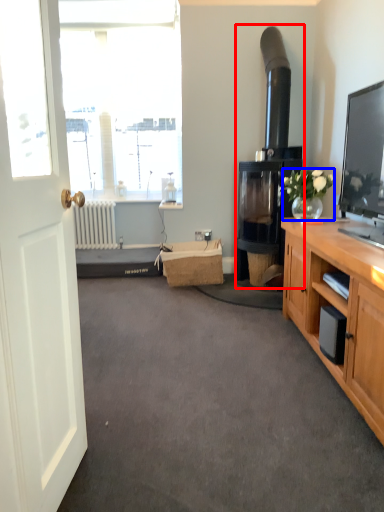
Question: Among these objects, which one is nearest to the camera, fireplace (highlighted by a red box) or houseplant (highlighted by a blue box)?

Choices:
 (A) fireplace
 (B) houseplant

Answer: (B)